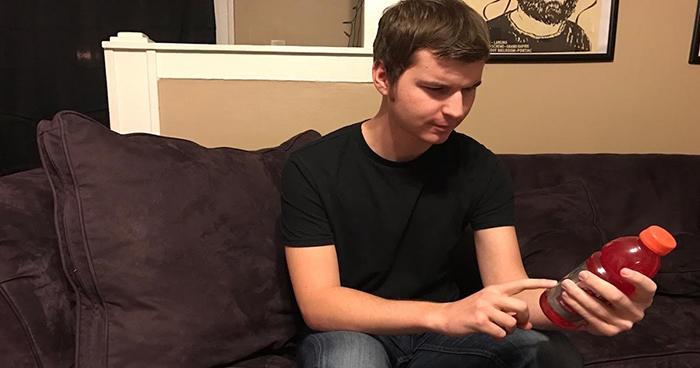
At what (x,y) coordinates should I click in order to perform the action: click on brown pillow. Please return your answer as a coordinate pair (x, y). The image size is (700, 368). Looking at the image, I should click on coord(194,230).